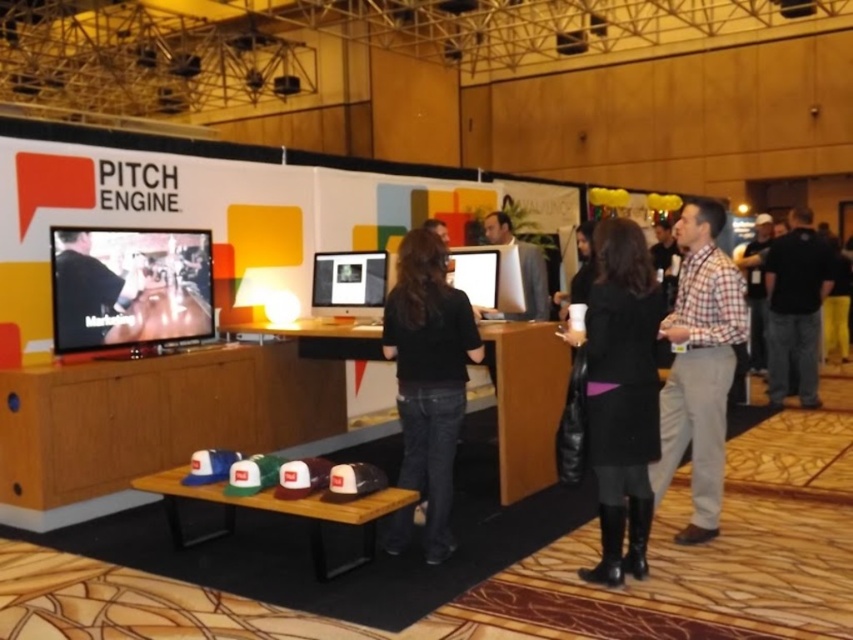
Which is more to the left, plaid shirt at center or black leather jacket at center?

From the viewer's perspective, black leather jacket at center appears more on the left side.

Where is `plaid shirt at center`? This screenshot has width=853, height=640. plaid shirt at center is located at coordinates (756, 289).

Locate an element on the screen. plaid shirt at center is located at coordinates (756, 289).

Between point (428, 429) and point (585, 228), which one is positioned in front?

Point (428, 429) is more forward.

Does black matte shirt at center have a larger size compared to black leather jacket at center?

Yes, black matte shirt at center is bigger than black leather jacket at center.

Find the location of `black matte shirt at center`. black matte shirt at center is located at coordinates (428, 376).

Identify the location of black matte shirt at center. (428, 376).

From the picture: Who is positioned more to the left, black cotton shirt at right or matte black shirt at center?

From the viewer's perspective, matte black shirt at center appears more on the left side.

Is point (804, 300) closer to camera compared to point (103, 305)?

No, it is not.

At what (x,y) coordinates should I click in order to perform the action: click on black cotton shirt at right. Please return your answer as a coordinate pair (x, y). This screenshot has height=640, width=853. Looking at the image, I should click on (795, 307).